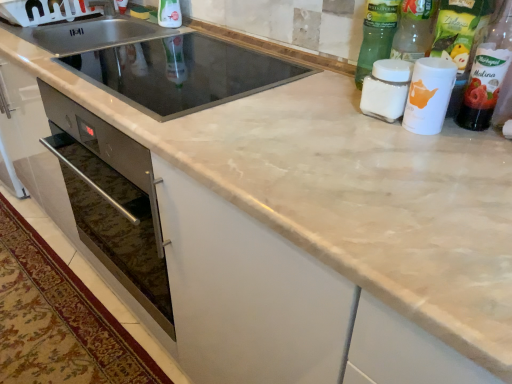
Where is `free region on the left part of green glass bottle at upper right, the 3th bottle positioned from the left`? The width and height of the screenshot is (512, 384). free region on the left part of green glass bottle at upper right, the 3th bottle positioned from the left is located at coordinates (314, 87).